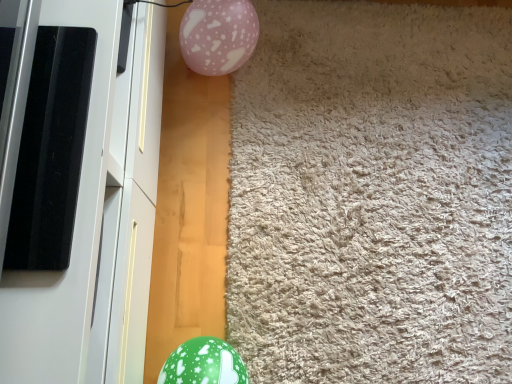
Question: Considering the relative positions of beige shaggy carpet at center and white glossy screen door at left in the image provided, is beige shaggy carpet at center to the left of white glossy screen door at left from the viewer's perspective?

Choices:
 (A) yes
 (B) no

Answer: (B)

Question: Is beige shaggy carpet at center facing towards white glossy screen door at left?

Choices:
 (A) yes
 (B) no

Answer: (B)

Question: Does beige shaggy carpet at center have a lesser height compared to white glossy screen door at left?

Choices:
 (A) no
 (B) yes

Answer: (B)

Question: Is white glossy screen door at left inside beige shaggy carpet at center?

Choices:
 (A) yes
 (B) no

Answer: (B)

Question: Considering the relative sizes of beige shaggy carpet at center and white glossy screen door at left in the image provided, is beige shaggy carpet at center thinner than white glossy screen door at left?

Choices:
 (A) no
 (B) yes

Answer: (A)

Question: Is beige shaggy carpet at center not inside white glossy screen door at left?

Choices:
 (A) no
 (B) yes

Answer: (B)

Question: Is green glossy balloon at lower left further to camera compared to white glossy screen door at left?

Choices:
 (A) no
 (B) yes

Answer: (B)

Question: Considering the relative sizes of green glossy balloon at lower left and white glossy screen door at left in the image provided, is green glossy balloon at lower left thinner than white glossy screen door at left?

Choices:
 (A) no
 (B) yes

Answer: (B)

Question: Is green glossy balloon at lower left outside white glossy screen door at left?

Choices:
 (A) yes
 (B) no

Answer: (A)

Question: Is green glossy balloon at lower left facing away from white glossy screen door at left?

Choices:
 (A) no
 (B) yes

Answer: (B)

Question: Is green glossy balloon at lower left aimed at white glossy screen door at left?

Choices:
 (A) yes
 (B) no

Answer: (B)

Question: Is green glossy balloon at lower left positioned far away from white glossy screen door at left?

Choices:
 (A) no
 (B) yes

Answer: (A)

Question: Can you confirm if beige shaggy carpet at center is smaller than pink glossy balloon at upper center?

Choices:
 (A) yes
 (B) no

Answer: (B)